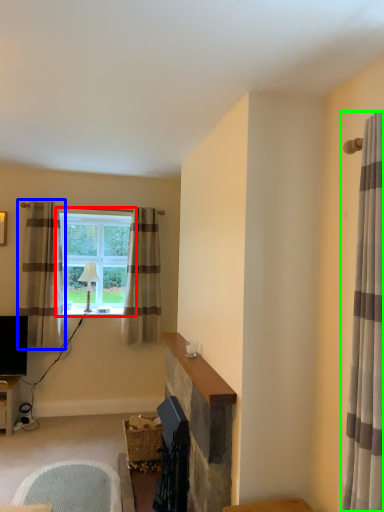
Question: Based on their relative distances, which object is nearer to window (highlighted by a red box)? Choose from curtain (highlighted by a blue box) and curtain (highlighted by a green box).

Choices:
 (A) curtain
 (B) curtain

Answer: (A)